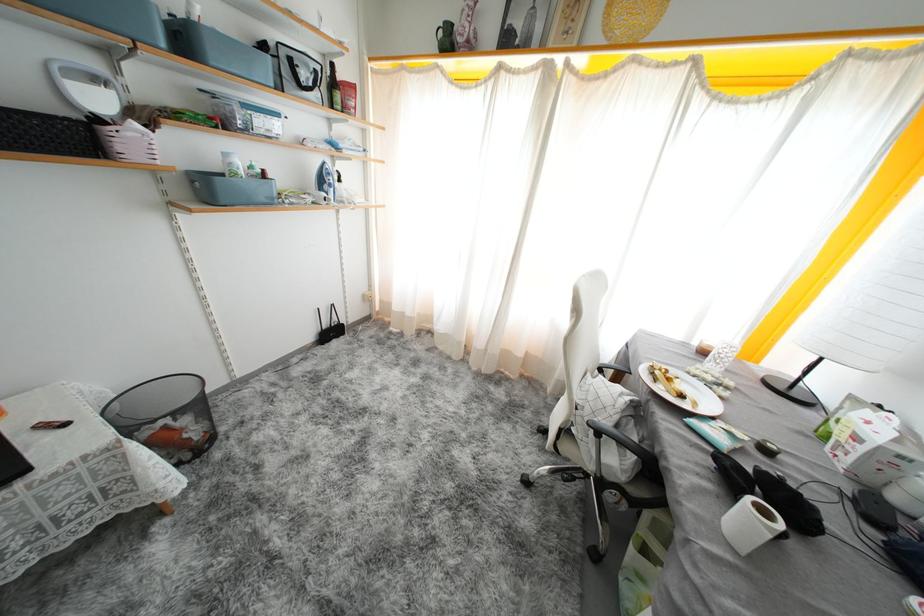
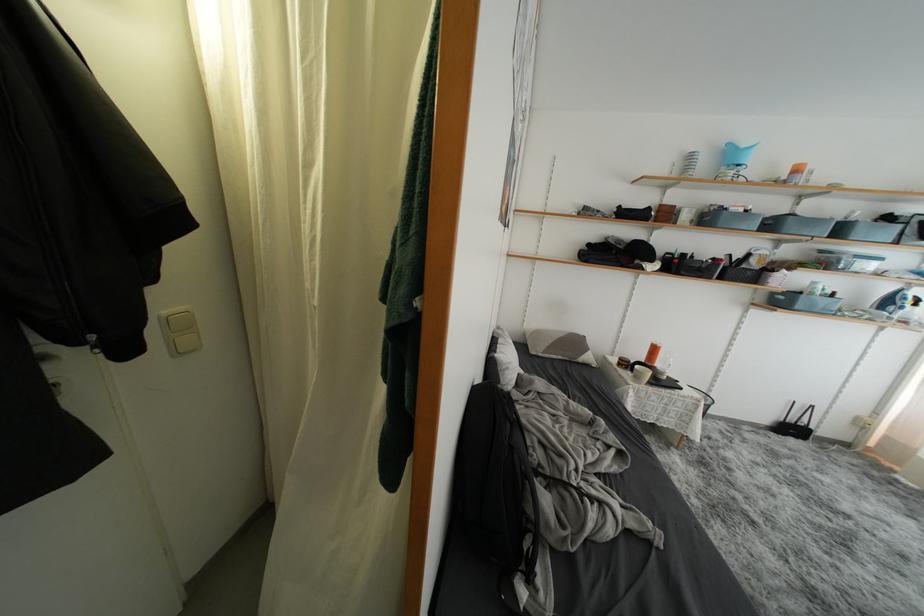
Where in the second image is the point corresponding to (x=337, y=337) from the first image?

(797, 434)